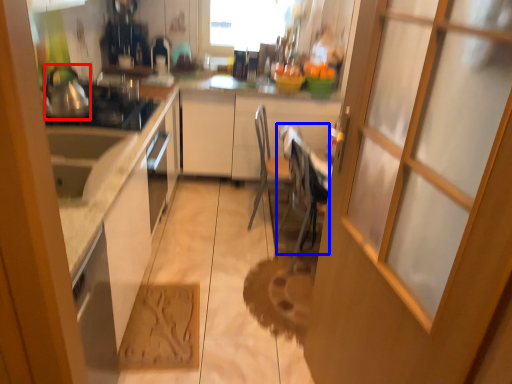
Question: Among these objects, which one is nearest to the camera, tea pot (highlighted by a red box) or chair (highlighted by a blue box)?

Choices:
 (A) tea pot
 (B) chair

Answer: (A)